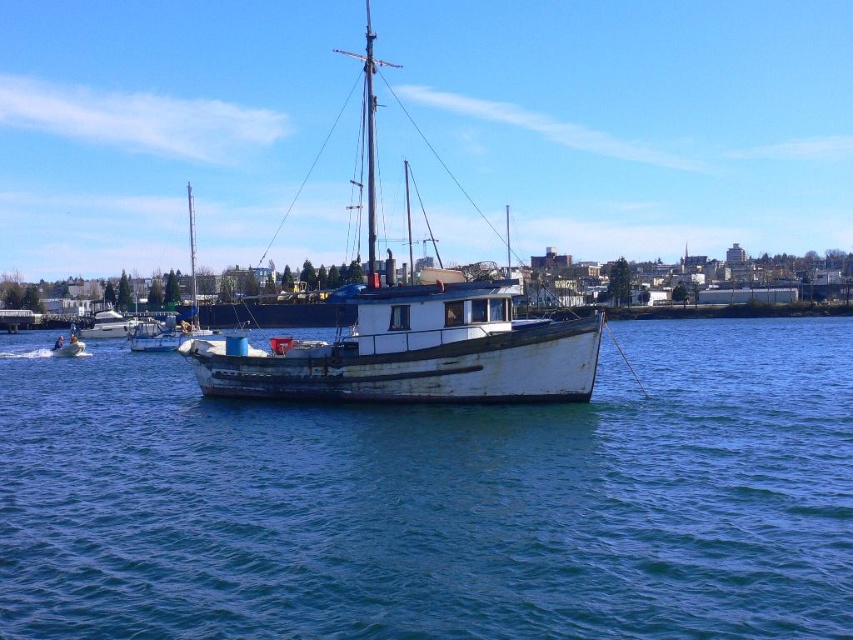
Question: Does blue water at center appear on the left side of rusty metal boat at left?

Choices:
 (A) no
 (B) yes

Answer: (A)

Question: Observing the image, what is the correct spatial positioning of blue water at center in reference to rusty metal boat at left?

Choices:
 (A) above
 (B) below

Answer: (B)

Question: Which of these objects is positioned farthest from the rusty metal boat at lower left?

Choices:
 (A) rusty metal boat at center
 (B) blue water at center

Answer: (A)

Question: Is blue water at center smaller than rusty metal boat at left?

Choices:
 (A) yes
 (B) no

Answer: (A)

Question: Among these points, which one is nearest to the camera?

Choices:
 (A) (113, 324)
 (B) (614, 620)
 (C) (463, 337)
 (D) (70, 348)

Answer: (B)

Question: Considering the real-world distances, which object is farthest from the rusty metal boat at center?

Choices:
 (A) blue water at center
 (B) rusty metal boat at lower left
 (C) rusty metal boat at left

Answer: (B)